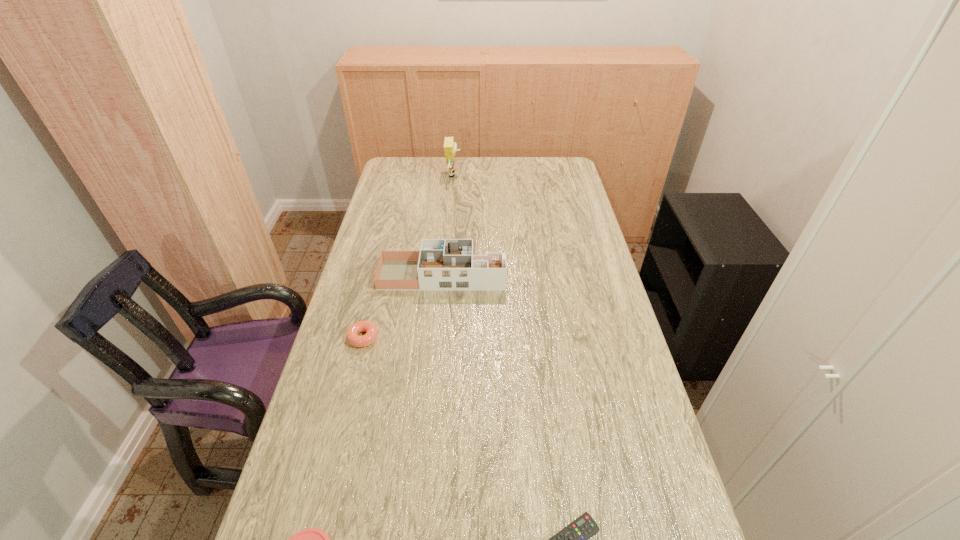
Locate an element on the screen. This screenshot has height=540, width=960. dollhouse that is at the left edge is located at coordinates (441, 264).

Locate an element on the screen. This screenshot has width=960, height=540. doughnut at the left edge is located at coordinates (354, 339).

Where is `free space at the far edge of the desktop`? Image resolution: width=960 pixels, height=540 pixels. free space at the far edge of the desktop is located at coordinates (482, 181).

At what (x,y) coordinates should I click in order to perform the action: click on free region at the left edge of the desktop. Please return your answer as a coordinate pair (x, y). Image resolution: width=960 pixels, height=540 pixels. Looking at the image, I should click on (388, 214).

This screenshot has width=960, height=540. What are the coordinates of `free space at the right edge of the desktop` in the screenshot? It's located at (605, 412).

Find the location of a particular element. This screenshot has width=960, height=540. vacant space at the far left corner of the desktop is located at coordinates [x=420, y=157].

At what (x,y) coordinates should I click in order to perform the action: click on vacant area that lies between the second tallest object and the sponge. Please return your answer as a coordinate pair (x, y). The height and width of the screenshot is (540, 960). Looking at the image, I should click on (448, 225).

At what (x,y) coordinates should I click in order to perform the action: click on vacant space in between the second shortest object and the dollhouse. Please return your answer as a coordinate pair (x, y). Looking at the image, I should click on (403, 306).

Where is `object that stands as the fourth closest to the dollhouse`? The height and width of the screenshot is (540, 960). object that stands as the fourth closest to the dollhouse is located at coordinates (312, 539).

Locate an element on the screen. The width and height of the screenshot is (960, 540). object that is the closest one to the farthest object is located at coordinates (441, 264).